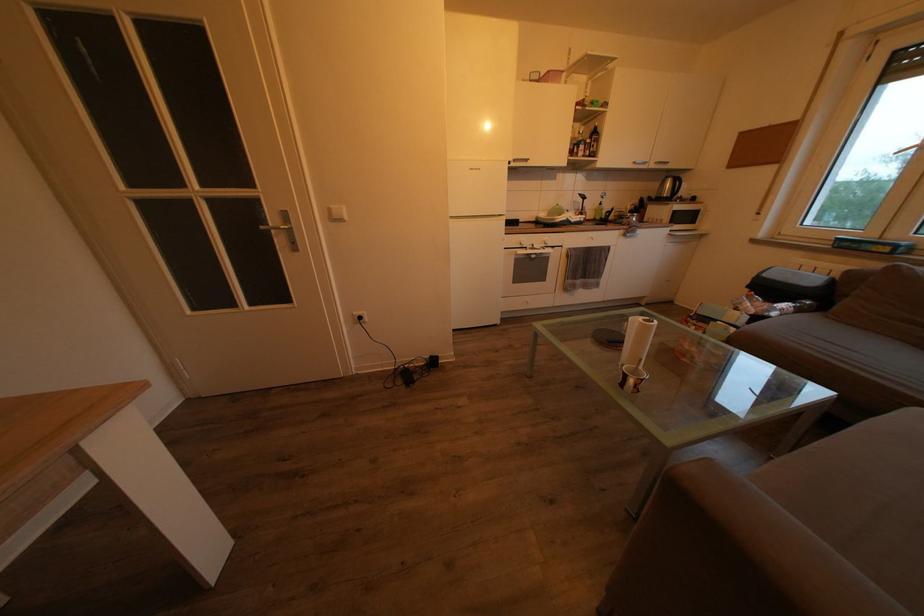
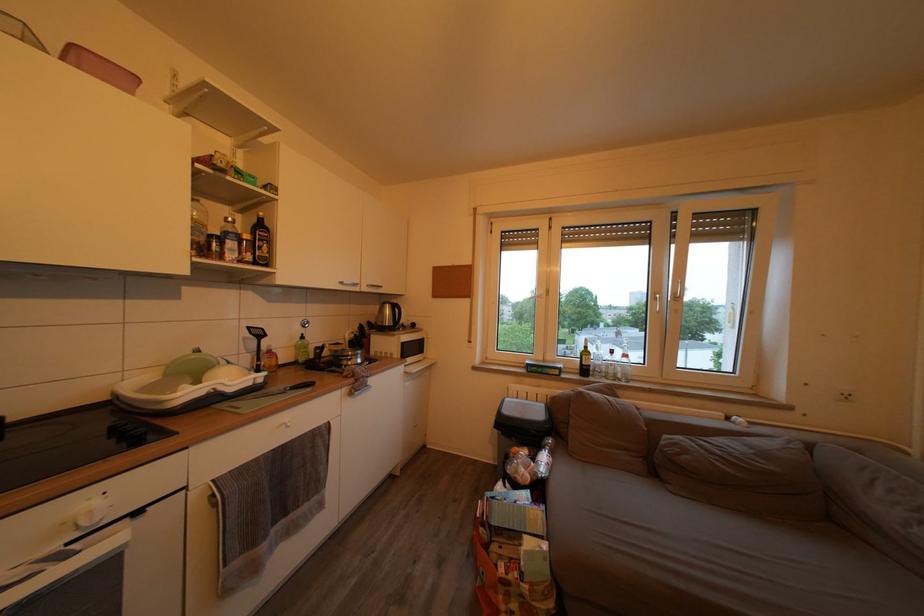
Locate, in the second image, the point that corresponds to [612,217] in the first image.

(320, 353)